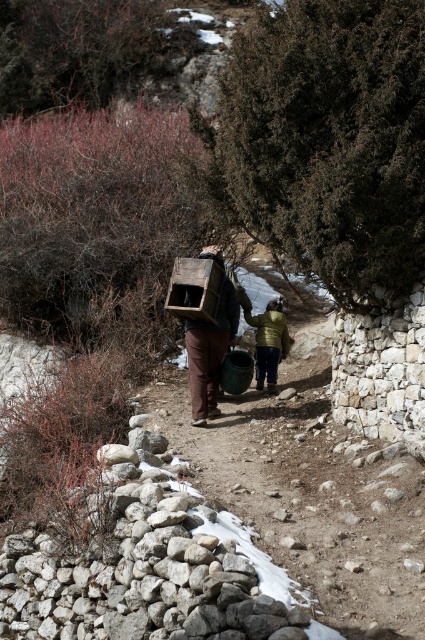
Which of these two, wooden crate at center or yellow-green fabric jacket at center, stands taller?

Standing taller between the two is yellow-green fabric jacket at center.

Image resolution: width=425 pixels, height=640 pixels. What are the coordinates of `wooden crate at center` in the screenshot? It's located at (195, 289).

Is brown matte wooden crate at center above yellow-green fabric jacket at center?

Correct, brown matte wooden crate at center is located above yellow-green fabric jacket at center.

Which of these two, brown matte wooden crate at center or yellow-green fabric jacket at center, stands shorter?

yellow-green fabric jacket at center

Image resolution: width=425 pixels, height=640 pixels. Identify the location of brown matte wooden crate at center. (209, 353).

Is the position of brown matte wooden crate at center more distant than that of wooden crate at center?

That is True.

Is brown matte wooden crate at center shorter than wooden crate at center?

Incorrect, brown matte wooden crate at center's height does not fall short of wooden crate at center's.

This screenshot has width=425, height=640. Describe the element at coordinates (209, 353) in the screenshot. I see `brown matte wooden crate at center` at that location.

Identify the location of brown matte wooden crate at center. (209, 353).